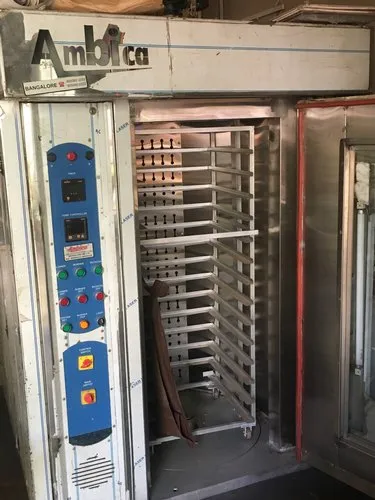
Where is `yellow light`? yellow light is located at coordinates (86, 323).